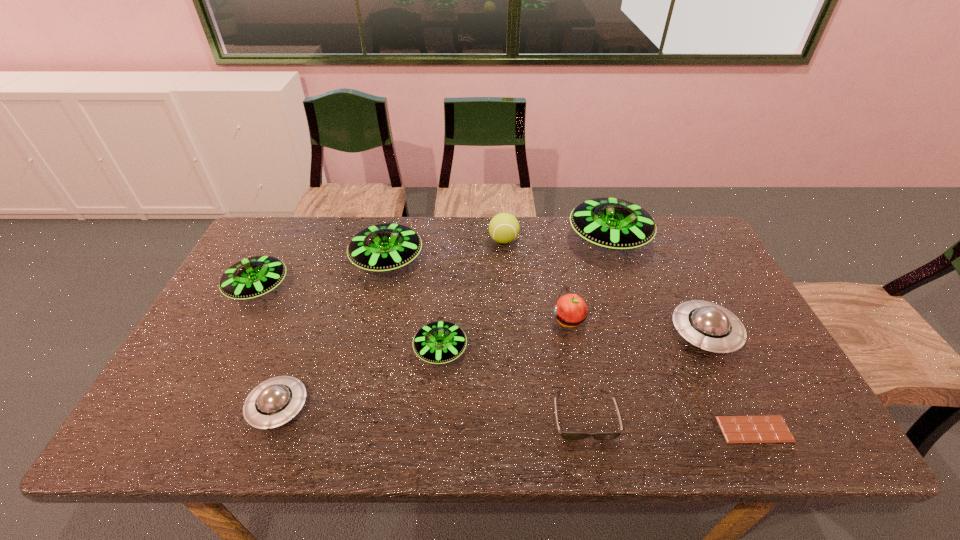
In the image, there is a desktop. Where is `vacant space at the far right corner`? vacant space at the far right corner is located at coordinates (654, 219).

The width and height of the screenshot is (960, 540). Identify the location of empty location between the shortest object and the black sunglasses. (669, 422).

Locate an element on the screen. empty space that is in between the sunglasses and the apple is located at coordinates (576, 368).

Where is `free point between the smaller gray saucer and the third smallest green saucer`? The width and height of the screenshot is (960, 540). free point between the smaller gray saucer and the third smallest green saucer is located at coordinates (333, 334).

The height and width of the screenshot is (540, 960). Identify the location of free spot between the second biggest green saucer and the nearest saucer. (333, 334).

I want to click on empty location between the biggest green saucer and the second shortest object, so click(596, 327).

Where is `vacant area between the biggest green saucer and the third saucer from right to left`? This screenshot has width=960, height=540. vacant area between the biggest green saucer and the third saucer from right to left is located at coordinates (524, 294).

The width and height of the screenshot is (960, 540). In order to click on unoccupied position between the tallest saucer and the tennis ball in this screenshot , I will do `click(556, 240)`.

You are a GUI agent. You are given a task and a screenshot of the screen. Output one action in this format:
    pyautogui.click(x=<x>, y=<y>)
    Task: Click on the vacant area between the apple and the fourth object from left to right
    The width and height of the screenshot is (960, 540).
    Given the screenshot: What is the action you would take?
    pyautogui.click(x=505, y=335)

This screenshot has width=960, height=540. Identify the location of vacant space in between the leftmost saucer and the second biggest green saucer. (323, 274).